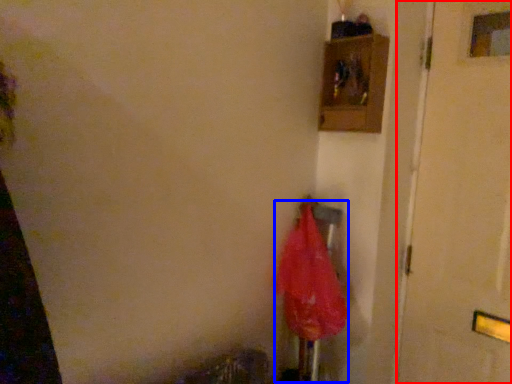
Question: Which of the following is the farthest to the observer, door (highlighted by a red box) or umbrella (highlighted by a blue box)?

Choices:
 (A) door
 (B) umbrella

Answer: (B)